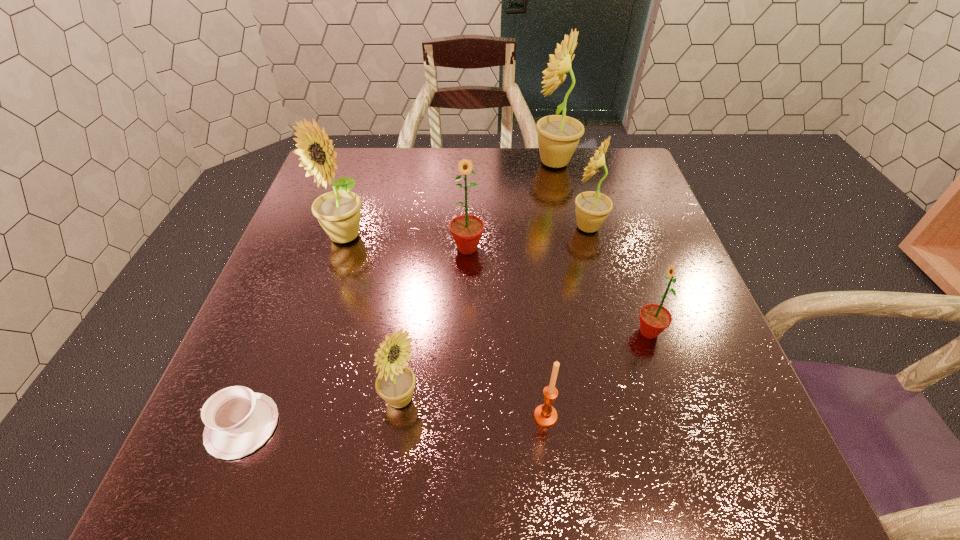
The height and width of the screenshot is (540, 960). Find the location of `free spot located on the face of the farther green sunflower`. free spot located on the face of the farther green sunflower is located at coordinates (463, 406).

The height and width of the screenshot is (540, 960). What are the coordinates of `vacant space located 0.340m on the face of the sixth object from right to left` in the screenshot? It's located at (618, 400).

The image size is (960, 540). In order to click on free space located on the face of the fifth farthest object in this screenshot , I will do `click(557, 332)`.

In order to click on vacant space located on the face of the fifth farthest object in this screenshot , I will do `click(536, 332)`.

Locate an element on the screen. The width and height of the screenshot is (960, 540). vacant space located 0.290m on the face of the fifth farthest object is located at coordinates (485, 332).

Where is `free location located 0.060m on the right of the candle_holder`? The image size is (960, 540). free location located 0.060m on the right of the candle_holder is located at coordinates (593, 416).

This screenshot has width=960, height=540. I want to click on object at the far edge, so click(x=558, y=135).

The image size is (960, 540). In order to click on object situated at the near edge in this screenshot , I will do `click(238, 421)`.

At what (x,y) coordinates should I click in order to perform the action: click on sunflower present at the left edge. Please return your answer as a coordinate pair (x, y). The height and width of the screenshot is (540, 960). Looking at the image, I should click on [x=338, y=212].

Where is `teacup situated at the left edge`? teacup situated at the left edge is located at coordinates (238, 421).